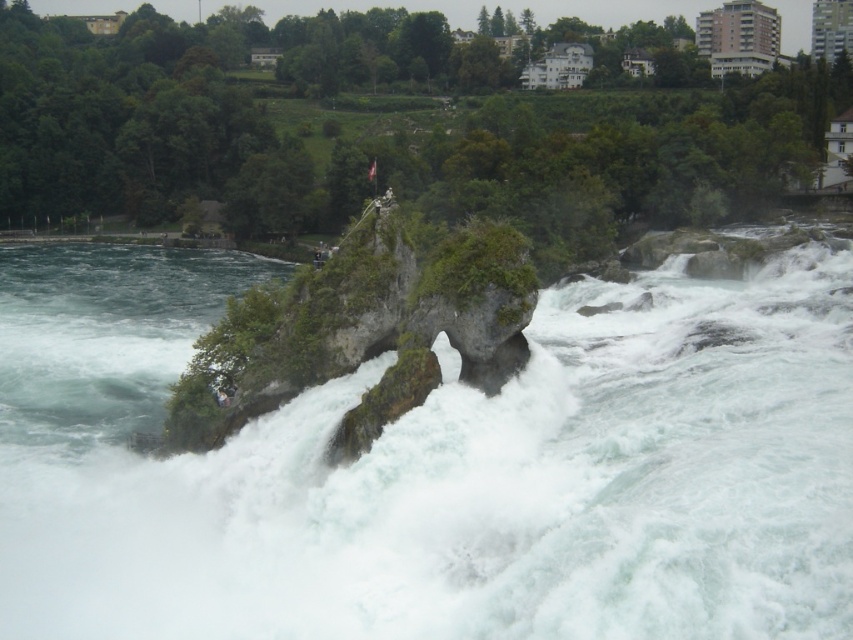
Question: Where is white frothy water at center located in relation to green mossy rock at center in the image?

Choices:
 (A) above
 (B) below

Answer: (B)

Question: Among these points, which one is nearest to the camera?

Choices:
 (A) (61, 273)
 (B) (426, 362)

Answer: (B)

Question: Is white frothy water at center wider than green mossy rock at center?

Choices:
 (A) yes
 (B) no

Answer: (A)

Question: Which of the following is the farthest from the observer?

Choices:
 (A) white frothy water at center
 (B) green mossy rock at center

Answer: (B)

Question: Does white frothy water at center have a lesser width compared to green mossy rock at center?

Choices:
 (A) yes
 (B) no

Answer: (B)